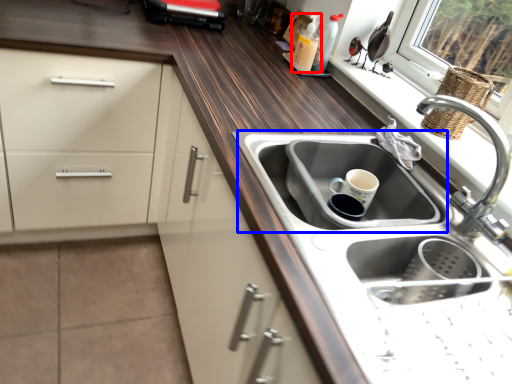
Question: Which point is further to the camera, bottle (highlighted by a red box) or sink (highlighted by a blue box)?

Choices:
 (A) bottle
 (B) sink

Answer: (A)